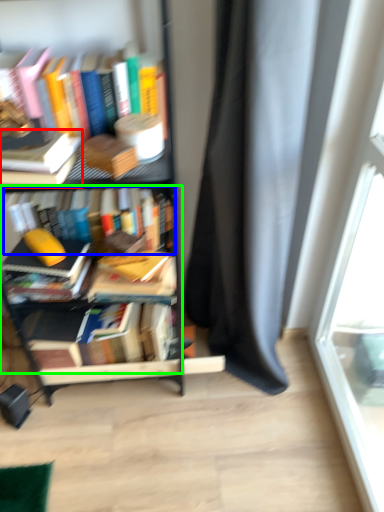
Question: Which is nearer to the book (highlighted by a red box)? book (highlighted by a blue box) or book (highlighted by a green box).

Choices:
 (A) book
 (B) book

Answer: (B)